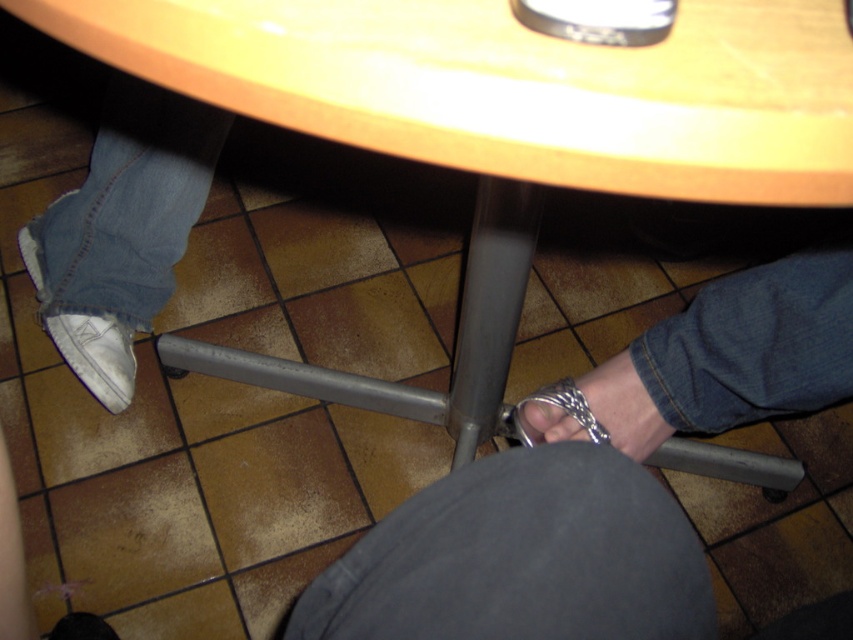
Question: Which object appears farthest from the camera in this image?

Choices:
 (A) white suede shoe at lower left
 (B) silver metallic toe at lower center

Answer: (A)

Question: Is silver metallic handcuffs at lower center closer to the viewer compared to white suede shoe at lower left?

Choices:
 (A) yes
 (B) no

Answer: (A)

Question: Which of the following is the farthest from the observer?

Choices:
 (A) white suede shoe at lower left
 (B) silver metallic chain at lower right
 (C) silver metallic handcuffs at lower center

Answer: (A)

Question: Is silver metallic chain at lower right thinner than silver metallic toe at lower center?

Choices:
 (A) yes
 (B) no

Answer: (B)

Question: Can you confirm if silver metallic handcuffs at lower center is thinner than silver metallic toe at lower center?

Choices:
 (A) no
 (B) yes

Answer: (A)

Question: Which object is farther from the camera taking this photo?

Choices:
 (A) silver metallic handcuffs at lower center
 (B) white suede shoe at lower left

Answer: (B)